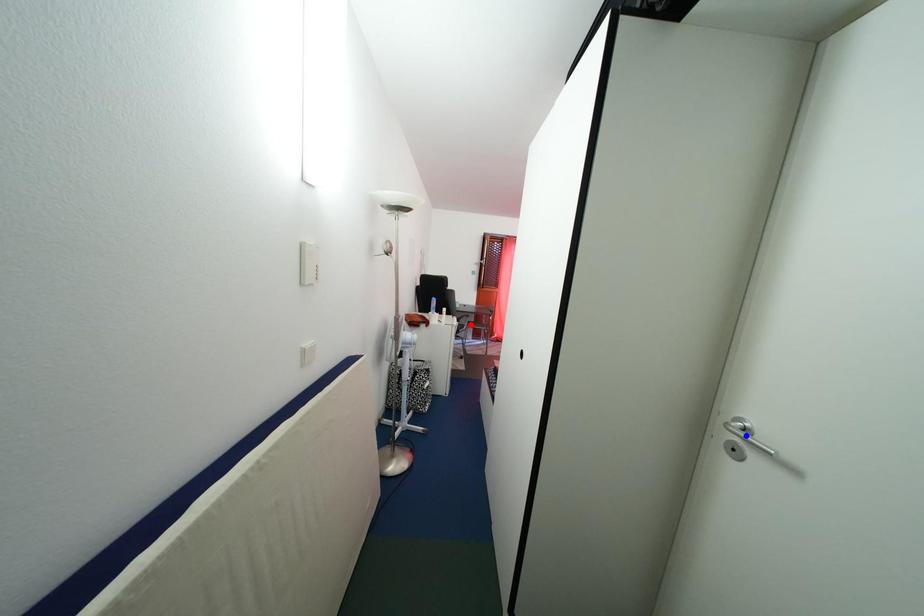
Question: In the image, two points are highlighted. Which point is nearer to the camera? Reply with the corresponding letter.

Choices:
 (A) blue point
 (B) red point

Answer: (A)